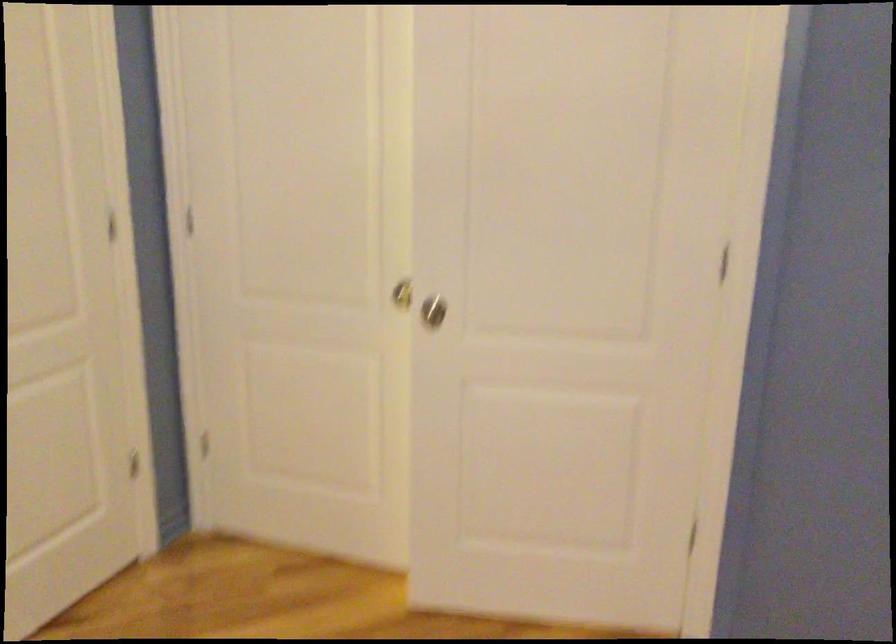
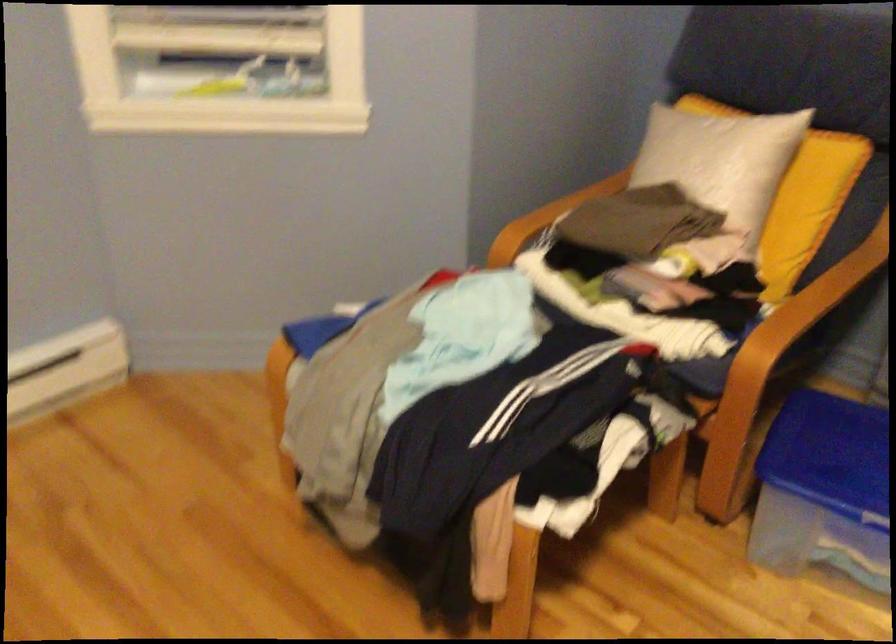
How did the camera likely rotate?

The camera's rotation is toward left-down.